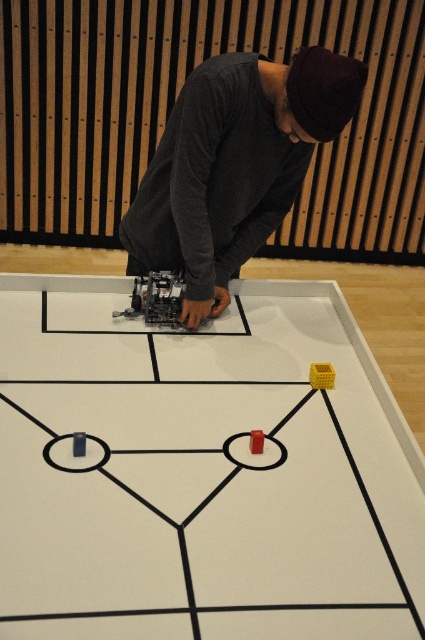
Can you confirm if matte plastic board game at center is thinner than dark gray sweater at center?

No, matte plastic board game at center is not thinner than dark gray sweater at center.

How far apart are matte plastic board game at center and dark gray sweater at center?

matte plastic board game at center is 45.55 centimeters from dark gray sweater at center.

The image size is (425, 640). I want to click on matte plastic board game at center, so [201, 472].

The image size is (425, 640). I want to click on matte plastic board game at center, so click(201, 472).